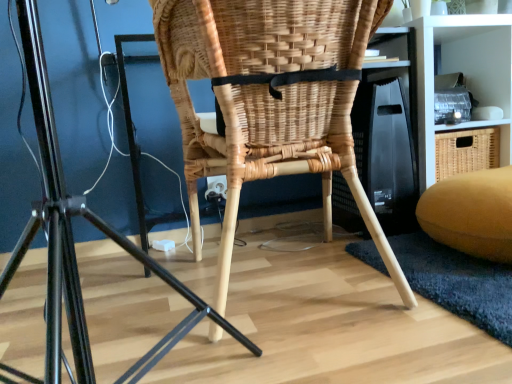
Question: Is natural wicker chair at center taller or shorter than velvet yellow bean bag at lower right?

Choices:
 (A) short
 (B) tall

Answer: (B)

Question: Is natural wicker chair at center to the left or to the right of velvet yellow bean bag at lower right in the image?

Choices:
 (A) left
 (B) right

Answer: (A)

Question: Which is nearer to the white matte shelf at upper right?

Choices:
 (A) natural woven chair at center
 (B) velvet yellow bean bag at lower right
 (C) natural wicker chair at center

Answer: (B)

Question: Which of these objects is positioned farthest from the natural wicker chair at center?

Choices:
 (A) natural woven chair at center
 (B) white matte shelf at upper right
 (C) velvet yellow bean bag at lower right

Answer: (B)